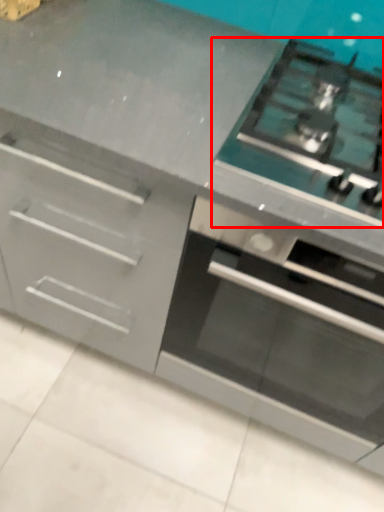
Question: From the image's perspective, where is gas stove (annotated by the red box) located relative to oven?

Choices:
 (A) above
 (B) below

Answer: (A)